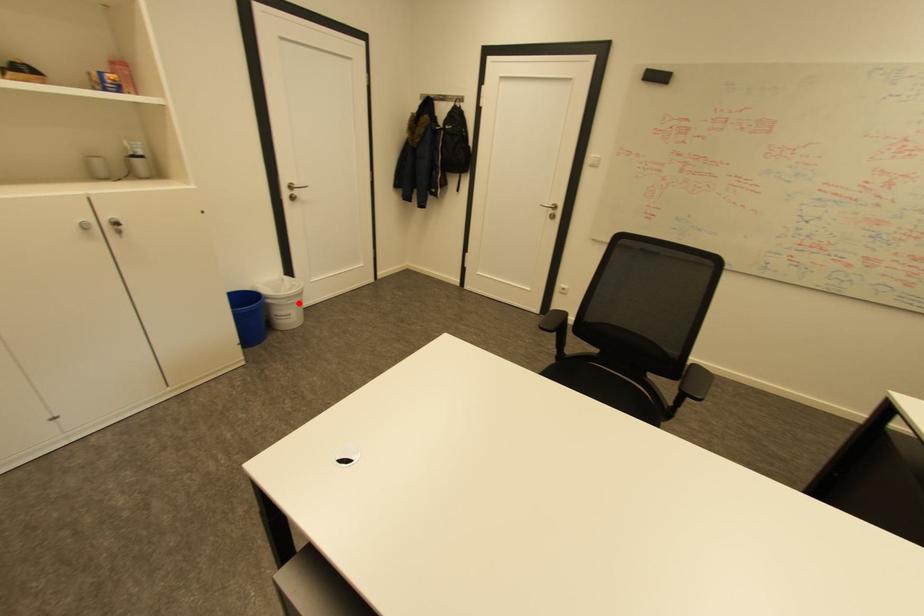
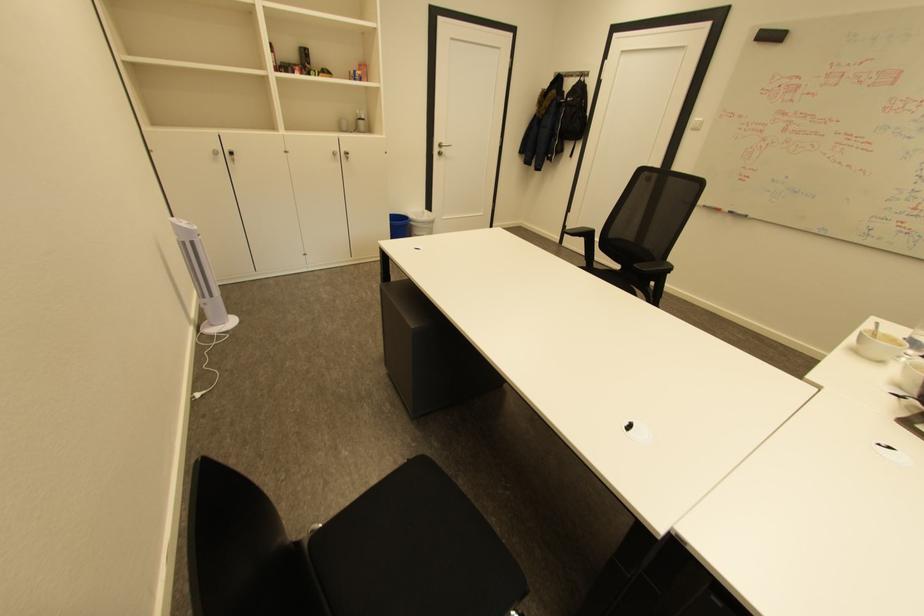
In the second image, find the point that corresponds to the highlighted location in the first image.

(432, 227)